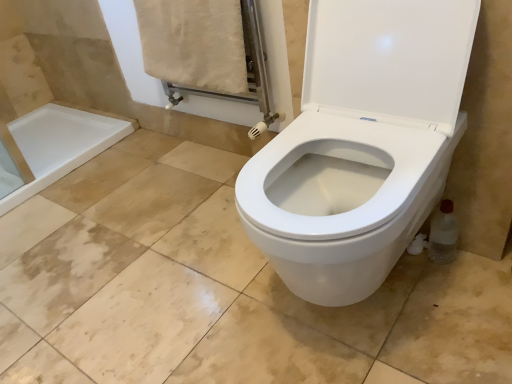
Question: From the image's perspective, is beige cotton towel at upper left on clear plastic bottle at lower right?

Choices:
 (A) yes
 (B) no

Answer: (A)

Question: Is beige cotton towel at upper left positioned with its back to clear plastic bottle at lower right?

Choices:
 (A) no
 (B) yes

Answer: (A)

Question: Considering the relative sizes of beige cotton towel at upper left and clear plastic bottle at lower right in the image provided, is beige cotton towel at upper left smaller than clear plastic bottle at lower right?

Choices:
 (A) no
 (B) yes

Answer: (A)

Question: Considering the relative sizes of beige cotton towel at upper left and clear plastic bottle at lower right in the image provided, is beige cotton towel at upper left taller than clear plastic bottle at lower right?

Choices:
 (A) yes
 (B) no

Answer: (A)

Question: Is beige cotton towel at upper left wider than clear plastic bottle at lower right?

Choices:
 (A) yes
 (B) no

Answer: (A)

Question: Considering the relative positions of beige cotton towel at upper left and clear plastic bottle at lower right in the image provided, is beige cotton towel at upper left to the right of clear plastic bottle at lower right from the viewer's perspective?

Choices:
 (A) yes
 (B) no

Answer: (B)

Question: From the image's perspective, is clear plastic bottle at lower right on beige cotton towel at upper left?

Choices:
 (A) no
 (B) yes

Answer: (A)

Question: From a real-world perspective, is clear plastic bottle at lower right on beige cotton towel at upper left?

Choices:
 (A) no
 (B) yes

Answer: (A)

Question: Considering the relative positions of clear plastic bottle at lower right and beige cotton towel at upper left in the image provided, is clear plastic bottle at lower right to the left of beige cotton towel at upper left from the viewer's perspective?

Choices:
 (A) yes
 (B) no

Answer: (B)

Question: Does clear plastic bottle at lower right have a lesser height compared to beige cotton towel at upper left?

Choices:
 (A) no
 (B) yes

Answer: (B)

Question: Can you confirm if clear plastic bottle at lower right is taller than beige cotton towel at upper left?

Choices:
 (A) no
 (B) yes

Answer: (A)

Question: Is clear plastic bottle at lower right positioned before beige cotton towel at upper left?

Choices:
 (A) no
 (B) yes

Answer: (B)

Question: Would you say clear plastic bottle at lower right is to the left or to the right of beige cotton towel at upper left in the picture?

Choices:
 (A) left
 (B) right

Answer: (B)